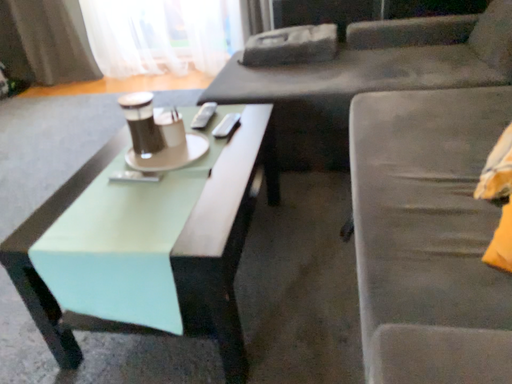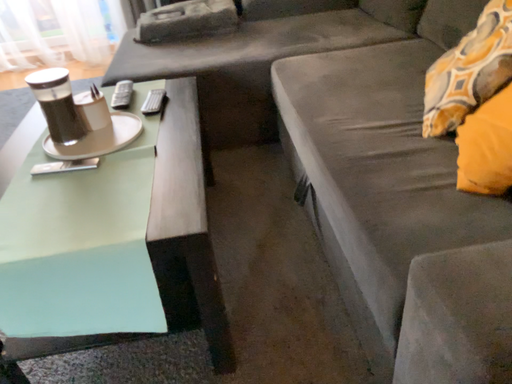
Question: How did the camera likely rotate when shooting the video?

Choices:
 (A) rotated right
 (B) rotated left

Answer: (A)